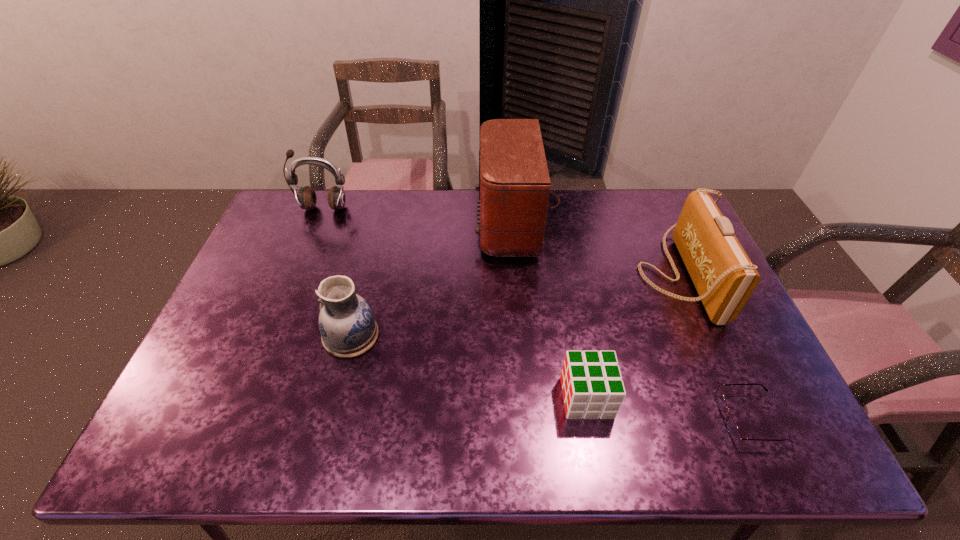
Locate an element on the screen. the tallest object is located at coordinates (514, 184).

The image size is (960, 540). I want to click on the leftmost object, so click(306, 197).

The image size is (960, 540). What are the coordinates of `handbag` in the screenshot? It's located at (723, 275).

Find the location of `pottery`. pottery is located at coordinates (348, 329).

Image resolution: width=960 pixels, height=540 pixels. Find the location of `the second shortest object`. the second shortest object is located at coordinates (592, 384).

Identify the location of spectacles. The height and width of the screenshot is (540, 960). (732, 428).

Where is `free region located 0.090m on the front panel of the radio receiver`? free region located 0.090m on the front panel of the radio receiver is located at coordinates (449, 224).

Where is `vacant region located on the front panel of the radio receiver`? vacant region located on the front panel of the radio receiver is located at coordinates (377, 224).

You are a GUI agent. You are given a task and a screenshot of the screen. Output one action in this format:
    pyautogui.click(x=<x>, y=<y>)
    Task: Click on the vacant space located 0.150m on the front panel of the radio receiver
    The width and height of the screenshot is (960, 540).
    Given the screenshot: What is the action you would take?
    pyautogui.click(x=432, y=224)

Identify the location of vacant region located on the ear pads of the leftmost object. The width and height of the screenshot is (960, 540). (313, 234).